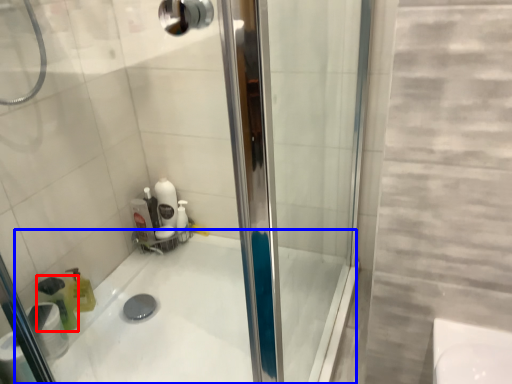
Question: Which object is closer to the camera taking this photo, cleaning product (highlighted by a red box) or bath (highlighted by a blue box)?

Choices:
 (A) cleaning product
 (B) bath

Answer: (B)